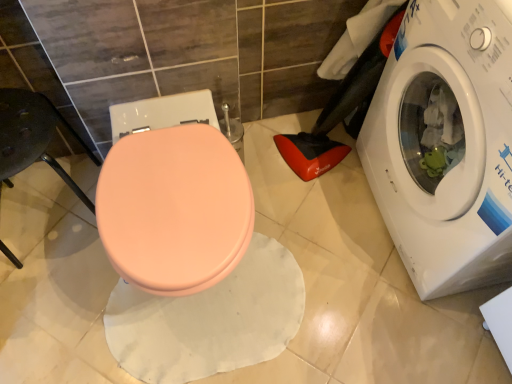
The width and height of the screenshot is (512, 384). What are the coordinates of `vacant space in front of matte pink seat at left` in the screenshot? It's located at (49, 309).